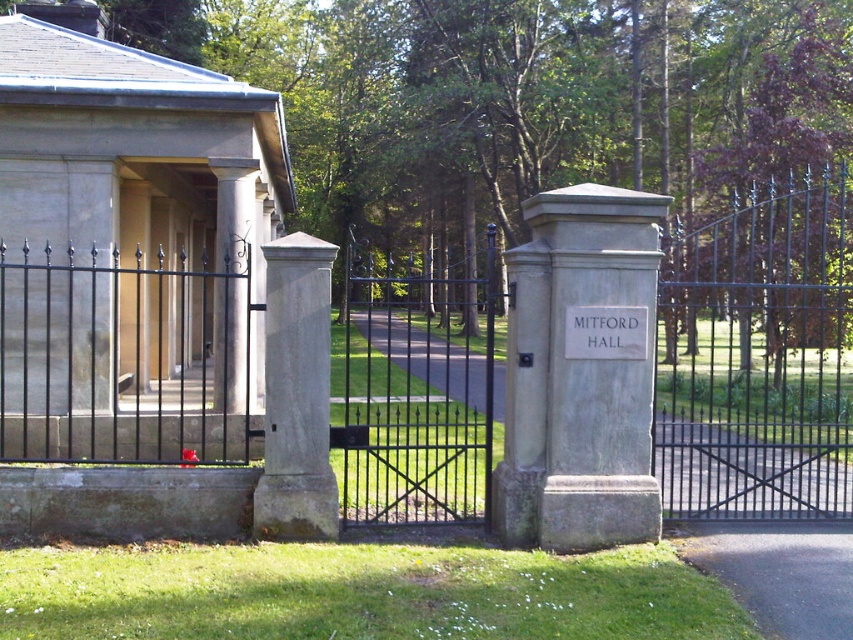
Question: Is black wrought iron gate at center wider than gray stone sign at center?

Choices:
 (A) yes
 (B) no

Answer: (A)

Question: Which object is positioned farthest from the smooth stone columns at center?

Choices:
 (A) gray stone sign at center
 (B) black metal fence at center
 (C) black wrought iron gate at left
 (D) black wrought iron gate at center

Answer: (D)

Question: Does black metal fence at center have a larger size compared to black wrought iron gate at center?

Choices:
 (A) no
 (B) yes

Answer: (B)

Question: Can you confirm if black metal fence at center is positioned to the right of black wrought iron gate at left?

Choices:
 (A) yes
 (B) no

Answer: (A)

Question: Which point appears farthest from the camera in this image?

Choices:
 (A) (590, 337)
 (B) (167, 371)

Answer: (B)

Question: Among these points, which one is farthest from the camera?

Choices:
 (A) (167, 376)
 (B) (630, 316)
 (C) (125, 420)
 (D) (457, 461)

Answer: (A)